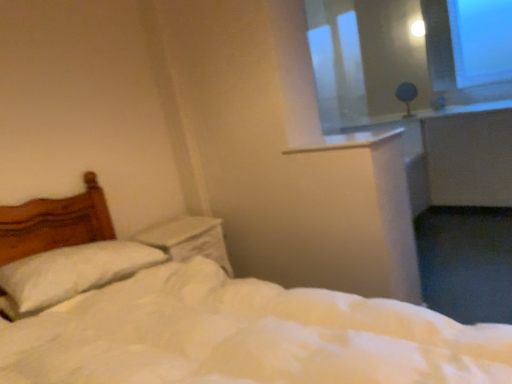
Question: Is white plastic window sill at upper center to the left of transparent plastic window screen at upper right from the viewer's perspective?

Choices:
 (A) no
 (B) yes

Answer: (A)

Question: Is transparent plastic window screen at upper right completely or partially inside white plastic window sill at upper center?

Choices:
 (A) yes
 (B) no

Answer: (B)

Question: Is white plastic window sill at upper center in contact with transparent plastic window screen at upper right?

Choices:
 (A) no
 (B) yes

Answer: (A)

Question: Is there a large distance between white plastic window sill at upper center and transparent plastic window screen at upper right?

Choices:
 (A) no
 (B) yes

Answer: (B)

Question: Does white plastic window sill at upper center have a greater width compared to transparent plastic window screen at upper right?

Choices:
 (A) yes
 (B) no

Answer: (A)

Question: Is white plastic window sill at upper center positioned behind transparent plastic window screen at upper right?

Choices:
 (A) no
 (B) yes

Answer: (A)

Question: Is white soft bed at center to the right of matte gray table lamp at upper right from the viewer's perspective?

Choices:
 (A) no
 (B) yes

Answer: (A)

Question: Does white soft bed at center have a greater height compared to matte gray table lamp at upper right?

Choices:
 (A) yes
 (B) no

Answer: (A)

Question: Does white soft bed at center appear on the left side of matte gray table lamp at upper right?

Choices:
 (A) no
 (B) yes

Answer: (B)

Question: Are white soft bed at center and matte gray table lamp at upper right making contact?

Choices:
 (A) yes
 (B) no

Answer: (B)

Question: From a real-world perspective, is white soft bed at center on matte gray table lamp at upper right?

Choices:
 (A) no
 (B) yes

Answer: (A)

Question: From the image's perspective, does white soft bed at center appear lower than matte gray table lamp at upper right?

Choices:
 (A) yes
 (B) no

Answer: (A)

Question: From the image's perspective, would you say white plastic window sill at upper center is shown under white soft pillow at left?

Choices:
 (A) yes
 (B) no

Answer: (B)